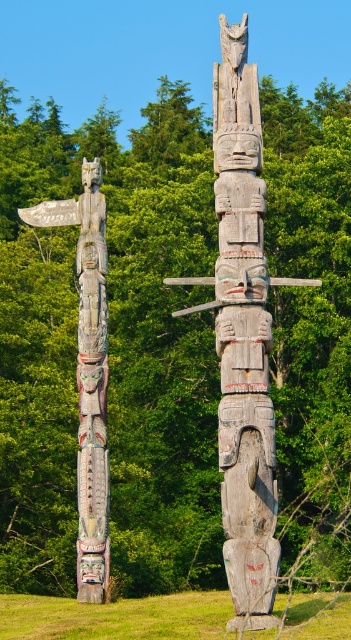
Does weathered wood totem pole at center appear on the right side of carved wooden totem pole at left?

Indeed, weathered wood totem pole at center is positioned on the right side of carved wooden totem pole at left.

Who is higher up, weathered wood totem pole at center or carved wooden totem pole at left?

Positioned higher is weathered wood totem pole at center.

Between point (233, 97) and point (107, 515), which one is positioned behind?

Positioned behind is point (107, 515).

Identify the location of weathered wood totem pole at center. (242, 337).